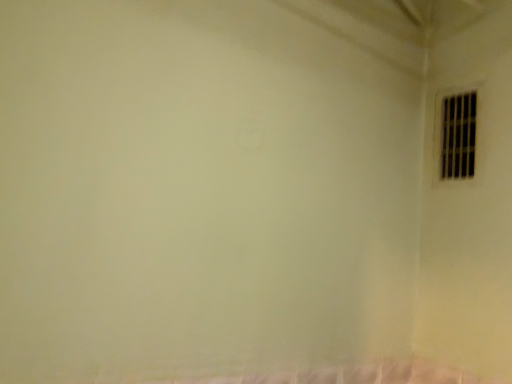
Find the location of a particular element. The height and width of the screenshot is (384, 512). black metal window at upper right is located at coordinates (455, 135).

What do you see at coordinates (455, 135) in the screenshot? I see `black metal window at upper right` at bounding box center [455, 135].

I want to click on black metal window at upper right, so click(455, 135).